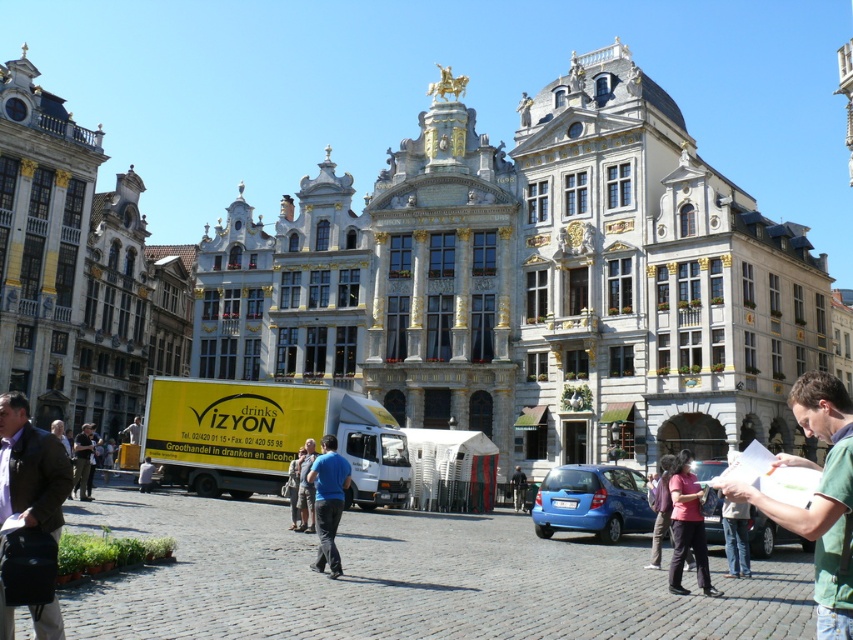
You are a photographer standing in the square and see a person wearing a brown leather jacket at lower left and dark blue jeans at lower left. Which item is located to the right of the other?

The brown leather jacket at lower left is positioned on the right side of dark blue jeans at lower left.

You are a photographer trying to capture both the brown leather jacket at lower left and the blue cotton shirt at center in a single frame. Which clothing item should you adjust your camera angle to focus on first to ensure both are in the shot?

The brown leather jacket at lower left is positioned on the left side of the blue cotton shirt at center. To ensure both are in the shot, focus on the brown leather jacket at lower left first as it is further to the left, allowing the blue cotton shirt at center to naturally fall into the frame from the center.